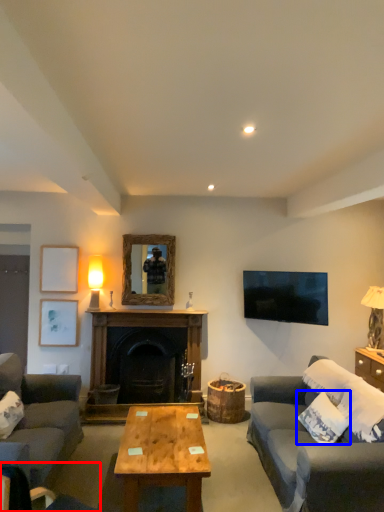
Question: Among these objects, which one is nearest to the camera, chair (highlighted by a red box) or pillow (highlighted by a blue box)?

Choices:
 (A) chair
 (B) pillow

Answer: (A)